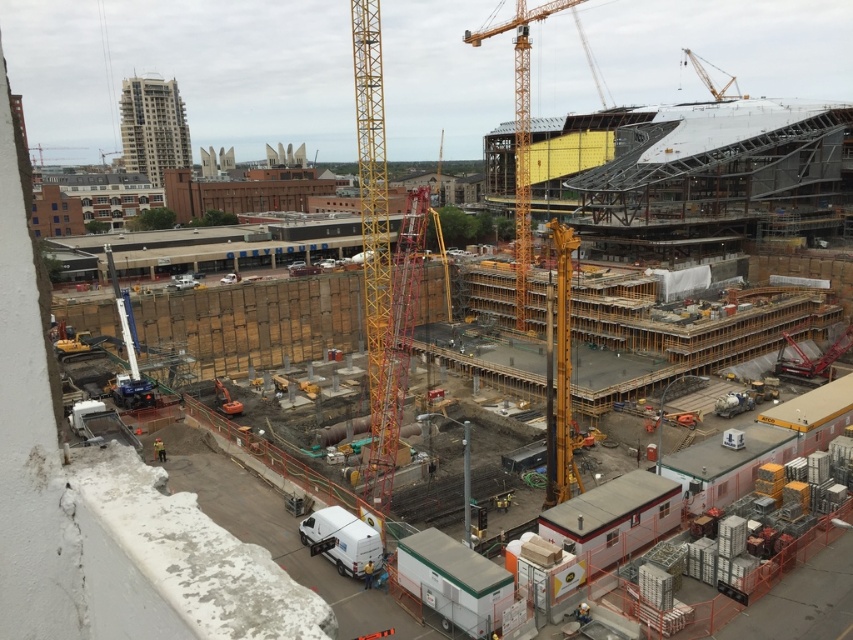
Question: Based on their relative distances, which object is nearer to the wooden planks at center?

Choices:
 (A) metallic yellow crane at center
 (B) white matte van at lower center
 (C) yellow metallic crane at upper right

Answer: (A)

Question: Is metallic yellow crane at center positioned before orange metallic excavator at center?

Choices:
 (A) no
 (B) yes

Answer: (A)

Question: From the image, what is the correct spatial relationship of white matte van at lower center in relation to yellow metallic crane at upper right?

Choices:
 (A) right
 (B) left

Answer: (B)

Question: Which of the following is the farthest from the observer?

Choices:
 (A) yellow metallic crane at upper right
 (B) wooden planks at center

Answer: (A)

Question: Among these objects, which one is nearest to the camera?

Choices:
 (A) wooden planks at center
 (B) white matte van at lower center

Answer: (A)

Question: Can you confirm if yellow metallic crane at center is thinner than metallic yellow crane at center?

Choices:
 (A) yes
 (B) no

Answer: (B)